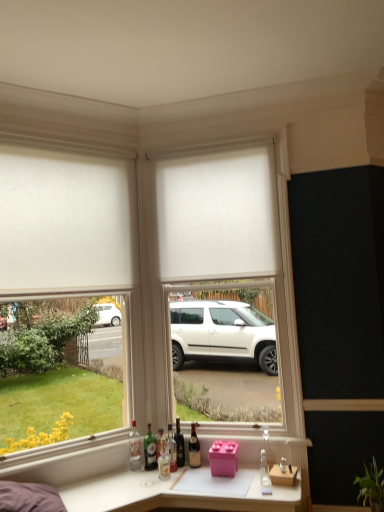
Question: Which direction should I rotate to look at brown glass bottle at center, marked as the sixth bottle in a left-to-right arrangement?

Choices:
 (A) right
 (B) left

Answer: (A)

Question: Can you confirm if white matte roller blind at upper left is wider than clear glass bottle at center, positioned as the seventh bottle in left-to-right order?

Choices:
 (A) no
 (B) yes

Answer: (A)

Question: From the image's perspective, is white matte roller blind at upper left on top of clear glass bottle at center, positioned as the seventh bottle in left-to-right order?

Choices:
 (A) yes
 (B) no

Answer: (A)

Question: Considering the relative sizes of white matte roller blind at upper left and clear glass bottle at center, which is counted as the first bottle, starting from the right, in the image provided, is white matte roller blind at upper left bigger than clear glass bottle at center, which is counted as the first bottle, starting from the right,?

Choices:
 (A) yes
 (B) no

Answer: (A)

Question: Is white matte roller blind at upper left aimed at clear glass bottle at center, which is counted as the first bottle, starting from the right?

Choices:
 (A) no
 (B) yes

Answer: (A)

Question: From a real-world perspective, is white matte roller blind at upper left positioned over clear glass bottle at center, which is counted as the first bottle, starting from the right, based on gravity?

Choices:
 (A) yes
 (B) no

Answer: (A)

Question: Is white matte roller blind at upper left to the right of clear glass bottle at center, which is counted as the first bottle, starting from the right, from the viewer's perspective?

Choices:
 (A) no
 (B) yes

Answer: (A)

Question: Does white matte window frame at center appear on the left side of clear glass bottle at lower left, positioned as the seventh bottle in right-to-left order?

Choices:
 (A) yes
 (B) no

Answer: (B)

Question: Does white matte window frame at center lie behind clear glass bottle at lower left, which is the 1th bottle from left to right?

Choices:
 (A) no
 (B) yes

Answer: (A)

Question: Is white matte window frame at center looking in the opposite direction of clear glass bottle at lower left, positioned as the seventh bottle in right-to-left order?

Choices:
 (A) yes
 (B) no

Answer: (B)

Question: From a real-world perspective, is white matte window frame at center positioned over clear glass bottle at lower left, which is the 1th bottle from left to right, based on gravity?

Choices:
 (A) yes
 (B) no

Answer: (A)

Question: Does white matte window frame at center have a greater height compared to clear glass bottle at lower left, positioned as the seventh bottle in right-to-left order?

Choices:
 (A) yes
 (B) no

Answer: (A)

Question: Is white matte window frame at center positioned far away from clear glass bottle at lower left, positioned as the seventh bottle in right-to-left order?

Choices:
 (A) yes
 (B) no

Answer: (A)

Question: Is clear glass bottle at center, positioned as the seventh bottle in left-to-right order, located within clear glass bottle at lower left, positioned as the seventh bottle in right-to-left order?

Choices:
 (A) no
 (B) yes

Answer: (A)